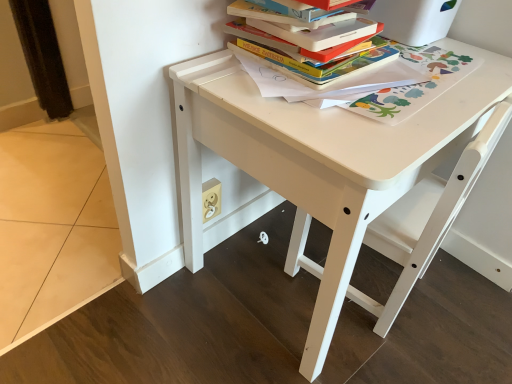
Question: Does hardcover books at upper center have a greater width compared to white matte chair at center?

Choices:
 (A) yes
 (B) no

Answer: (B)

Question: Can you confirm if hardcover books at upper center is thinner than white matte chair at center?

Choices:
 (A) yes
 (B) no

Answer: (A)

Question: Is white matte chair at center located within hardcover books at upper center?

Choices:
 (A) no
 (B) yes

Answer: (A)

Question: Are hardcover books at upper center and white matte chair at center located far from each other?

Choices:
 (A) yes
 (B) no

Answer: (B)

Question: Is hardcover books at upper center further to camera compared to white matte chair at center?

Choices:
 (A) yes
 (B) no

Answer: (A)

Question: From their relative heights in the image, would you say white matte chair at center is taller or shorter than white matte table at center?

Choices:
 (A) short
 (B) tall

Answer: (A)

Question: Does point (478, 153) appear closer or farther from the camera than point (366, 309)?

Choices:
 (A) closer
 (B) farther

Answer: (A)

Question: Choose the correct answer: Is white matte chair at center inside white matte table at center or outside it?

Choices:
 (A) inside
 (B) outside

Answer: (A)

Question: Relative to white matte table at center, is white matte chair at center in front or behind?

Choices:
 (A) behind
 (B) front

Answer: (A)

Question: Considering the positions of hardcover books at upper center and hardcover book at upper center in the image, is hardcover books at upper center bigger or smaller than hardcover book at upper center?

Choices:
 (A) big
 (B) small

Answer: (A)

Question: Do you think hardcover books at upper center is within hardcover book at upper center, or outside of it?

Choices:
 (A) outside
 (B) inside

Answer: (A)

Question: From the image's perspective, is hardcover books at upper center located above or below hardcover book at upper center?

Choices:
 (A) below
 (B) above

Answer: (A)

Question: From a real-world perspective, is hardcover books at upper center positioned above or below hardcover book at upper center?

Choices:
 (A) below
 (B) above

Answer: (A)

Question: From a real-world perspective, relative to hardcover books at upper center, is white matte chair at center vertically above or below?

Choices:
 (A) below
 (B) above

Answer: (A)

Question: Is white matte chair at center in front of or behind hardcover books at upper center in the image?

Choices:
 (A) behind
 (B) front

Answer: (B)